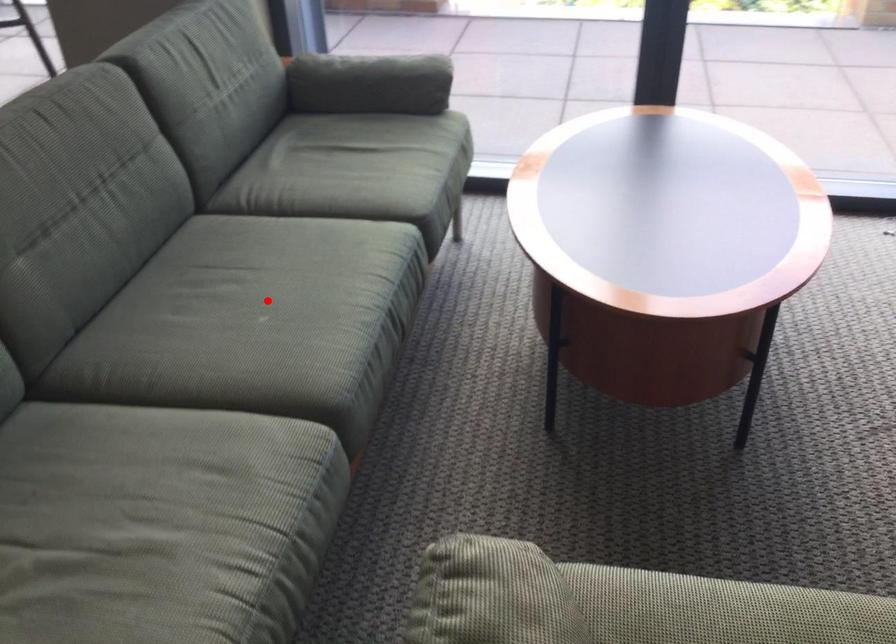
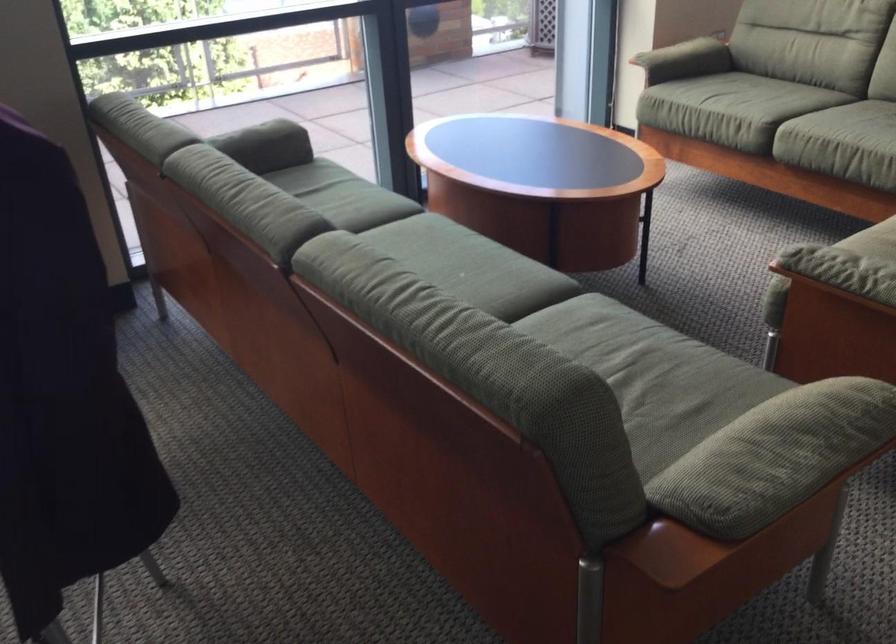
Question: I am providing you with two images of the same scene from different viewpoints. A red point is shown in image1. For the corresponding object point in image2, is it positioned nearer or farther from the camera?

Choices:
 (A) Nearer
 (B) Farther

Answer: (B)